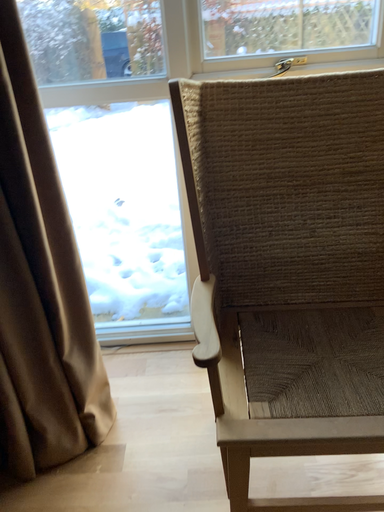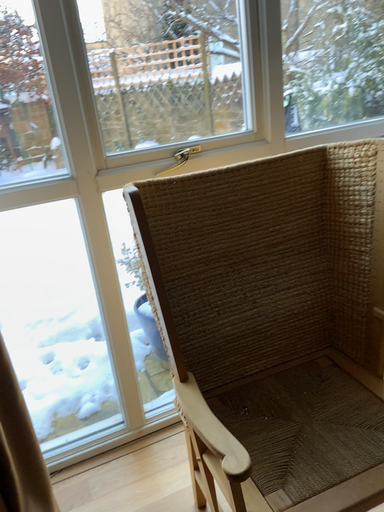
Question: Which way did the camera rotate in the video?

Choices:
 (A) rotated upward
 (B) rotated downward

Answer: (A)